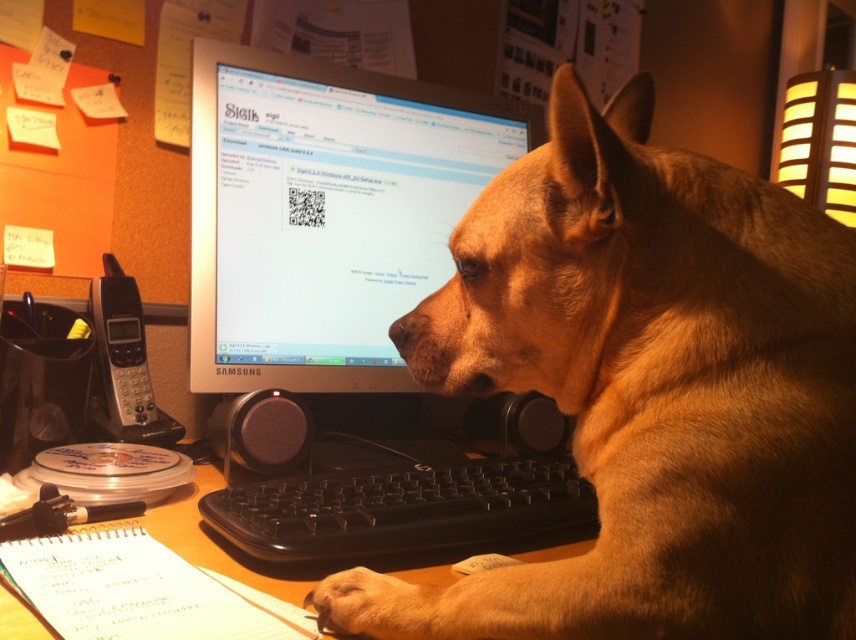
You are organizing items on a desk and need to place a new item between the black plastic phone at left and the brown fur paw at lower center. Considering their sizes, where should you position the new item?

Since the black plastic phone at left is taller than the brown fur paw at lower center, you should place the new item between them at a height that accommodates both objects, ensuring it doesn

What object is located at the coordinates point (324, 214)?

The point (324, 214) indicates the satin silver monitor at center.

You are organizing items on the desk and need to place a new item between the satin silver monitor at center and the wooden at lower left. Based on their positions, where should you place the new item?

The new item should be placed between the satin silver monitor at center and the wooden at lower left since the monitor is positioned over the wooden object, indicating they are aligned vertically.